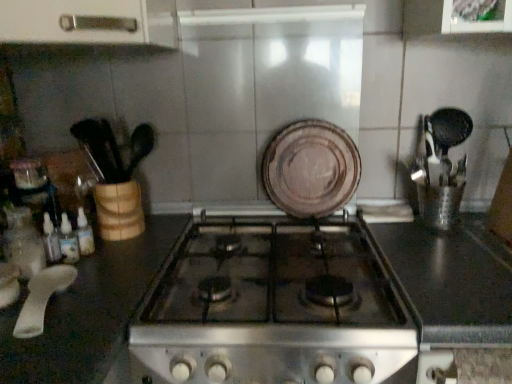
Question: Is white plastic spoon at lower left taller than black glass stove at center?

Choices:
 (A) no
 (B) yes

Answer: (A)

Question: From the image's perspective, is white plastic spoon at lower left on top of black glass stove at center?

Choices:
 (A) yes
 (B) no

Answer: (A)

Question: Does white plastic spoon at lower left appear on the left side of black glass stove at center?

Choices:
 (A) yes
 (B) no

Answer: (A)

Question: Is the position of white plastic spoon at lower left more distant than that of black glass stove at center?

Choices:
 (A) no
 (B) yes

Answer: (B)

Question: From a real-world perspective, is white plastic spoon at lower left physically below black glass stove at center?

Choices:
 (A) no
 (B) yes

Answer: (A)

Question: Is black glass stove at center situated inside brown matte plate at center or outside?

Choices:
 (A) inside
 (B) outside

Answer: (B)

Question: Considering the positions of black glass stove at center and brown matte plate at center in the image, is black glass stove at center taller or shorter than brown matte plate at center?

Choices:
 (A) short
 (B) tall

Answer: (A)

Question: Considering the positions of black glass stove at center and brown matte plate at center in the image, is black glass stove at center bigger or smaller than brown matte plate at center?

Choices:
 (A) small
 (B) big

Answer: (B)

Question: Does point (234, 380) appear closer or farther from the camera than point (330, 201)?

Choices:
 (A) closer
 (B) farther

Answer: (A)

Question: Based on their positions, is brown matte plate at center located to the left or right of black glass stove at center?

Choices:
 (A) left
 (B) right

Answer: (B)

Question: Is brown matte plate at center taller or shorter than black glass stove at center?

Choices:
 (A) tall
 (B) short

Answer: (A)

Question: Is brown matte plate at center inside the boundaries of black glass stove at center, or outside?

Choices:
 (A) inside
 (B) outside

Answer: (B)

Question: In the image, is brown matte plate at center positioned in front of or behind black glass stove at center?

Choices:
 (A) front
 (B) behind

Answer: (B)

Question: From the image's perspective, is white plastic spoon at lower left above or below brown matte plate at center?

Choices:
 (A) above
 (B) below

Answer: (B)

Question: From a real-world perspective, relative to brown matte plate at center, is white plastic spoon at lower left vertically above or below?

Choices:
 (A) below
 (B) above

Answer: (A)